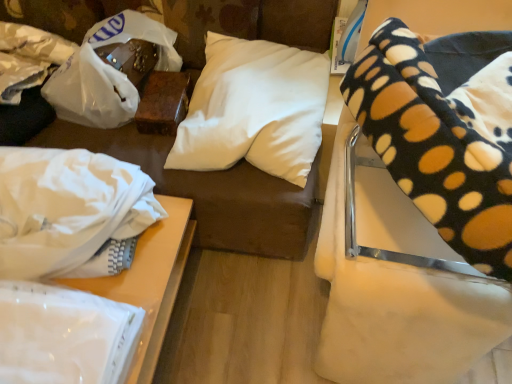
Question: From the image's perspective, is black polka dot blanket at upper right positioned above or below white soft pillow at upper center?

Choices:
 (A) below
 (B) above

Answer: (A)

Question: Considering the positions of black polka dot blanket at upper right and white soft pillow at upper center in the image, is black polka dot blanket at upper right wider or thinner than white soft pillow at upper center?

Choices:
 (A) thin
 (B) wide

Answer: (B)

Question: Considering the real-world distances, which object is farthest from the white fabric at left?

Choices:
 (A) black polka dot blanket at upper right
 (B) white soft pillow at upper center
 (C) white fabric at lower left
 (D) white glossy paper at lower left

Answer: (A)

Question: Which object is the closest to the white glossy paper at lower left?

Choices:
 (A) black polka dot blanket at upper right
 (B) white fabric at left
 (C) white fabric at lower left
 (D) white soft pillow at upper center

Answer: (C)